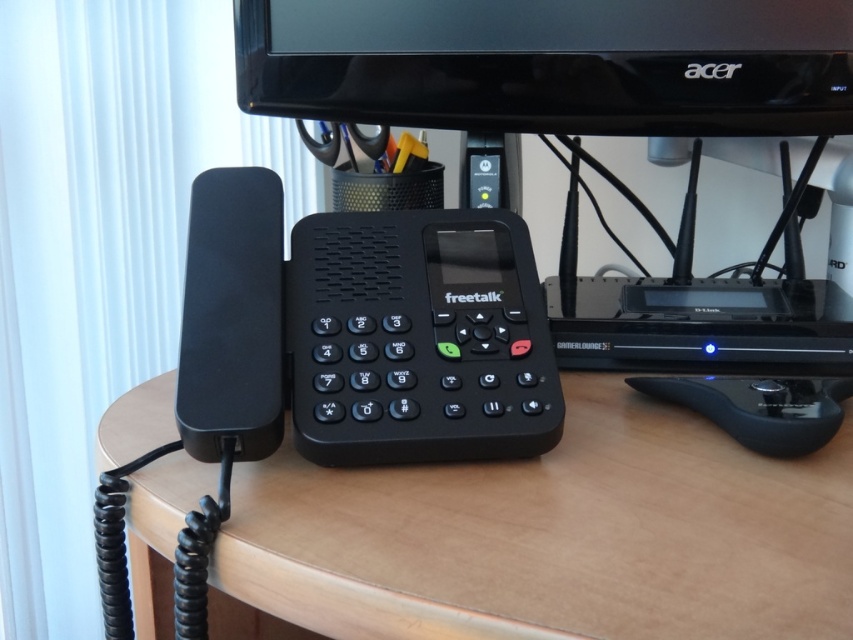
Question: Which object is closer to the camera taking this photo?

Choices:
 (A) black matte speaker at left
 (B) wooden at center
 (C) black plastic phone at center
 (D) black matte mouse at lower right

Answer: (B)

Question: Which object is closer to the camera taking this photo?

Choices:
 (A) wooden at center
 (B) black glossy monitor at upper center
 (C) black plastic phone at center
 (D) black matte mouse at lower right

Answer: (A)

Question: Based on their relative distances, which object is nearer to the wooden at center?

Choices:
 (A) black matte mouse at lower right
 (B) black matte speaker at left

Answer: (B)

Question: Can you confirm if black glossy monitor at upper center is smaller than black matte speaker at left?

Choices:
 (A) yes
 (B) no

Answer: (B)

Question: Does black glossy monitor at upper center have a lesser width compared to black plastic phone at center?

Choices:
 (A) no
 (B) yes

Answer: (A)

Question: Can you confirm if black plastic phone at center is bigger than black matte mouse at lower right?

Choices:
 (A) yes
 (B) no

Answer: (A)